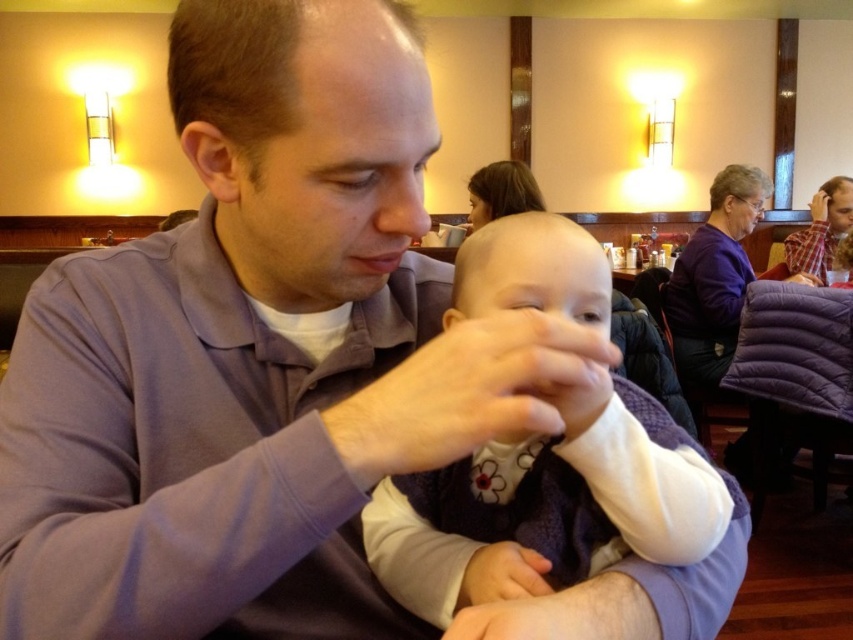
Question: Which object appears farthest from the camera in this image?

Choices:
 (A) plaid shirt at right
 (B) white soft fabric baby at center

Answer: (A)

Question: Is white soft fabric baby at center below plaid shirt at right?

Choices:
 (A) yes
 (B) no

Answer: (A)

Question: Which object is farther from the camera taking this photo?

Choices:
 (A) white soft fabric baby at center
 (B) plaid shirt at right

Answer: (B)

Question: Among these points, which one is nearest to the camera?

Choices:
 (A) (682, 509)
 (B) (833, 216)

Answer: (A)

Question: Is white soft fabric baby at center to the left of plaid shirt at right from the viewer's perspective?

Choices:
 (A) no
 (B) yes

Answer: (B)

Question: Does white soft fabric baby at center come behind plaid shirt at right?

Choices:
 (A) yes
 (B) no

Answer: (B)